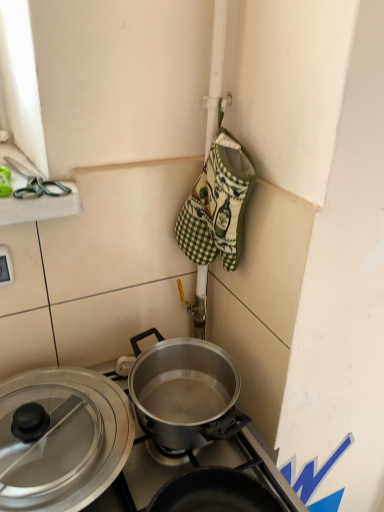
Question: Is green checkered oven mitt at center oriented away from white plastic electric outlet at lower left?

Choices:
 (A) yes
 (B) no

Answer: (B)

Question: Is green checkered oven mitt at center behind white plastic electric outlet at lower left?

Choices:
 (A) no
 (B) yes

Answer: (A)

Question: Can you confirm if green checkered oven mitt at center is bigger than white plastic electric outlet at lower left?

Choices:
 (A) no
 (B) yes

Answer: (B)

Question: Considering the relative sizes of green checkered oven mitt at center and white plastic electric outlet at lower left in the image provided, is green checkered oven mitt at center wider than white plastic electric outlet at lower left?

Choices:
 (A) yes
 (B) no

Answer: (A)

Question: Does green checkered oven mitt at center have a smaller size compared to white plastic electric outlet at lower left?

Choices:
 (A) no
 (B) yes

Answer: (A)

Question: Looking at the image, does polished silver pot at center seem bigger or smaller compared to white plastic electric outlet at lower left?

Choices:
 (A) small
 (B) big

Answer: (B)

Question: Based on their positions, is polished silver pot at center located to the left or right of white plastic electric outlet at lower left?

Choices:
 (A) left
 (B) right

Answer: (B)

Question: Is point (238, 442) positioned closer to the camera than point (1, 258)?

Choices:
 (A) farther
 (B) closer

Answer: (A)

Question: Is polished silver pot at center situated inside white plastic electric outlet at lower left or outside?

Choices:
 (A) inside
 (B) outside

Answer: (B)

Question: Looking at their shapes, would you say white plastic electric outlet at lower left is wider or thinner than green plastic scissors at upper left?

Choices:
 (A) thin
 (B) wide

Answer: (A)

Question: Is white plastic electric outlet at lower left in front of or behind green plastic scissors at upper left in the image?

Choices:
 (A) front
 (B) behind

Answer: (B)

Question: From the image's perspective, is white plastic electric outlet at lower left above or below green plastic scissors at upper left?

Choices:
 (A) above
 (B) below

Answer: (B)

Question: In the image, is white plastic electric outlet at lower left on the left side or the right side of green plastic scissors at upper left?

Choices:
 (A) right
 (B) left

Answer: (B)

Question: In the image, is white plastic electric outlet at lower left positioned in front of or behind polished silver pot at center?

Choices:
 (A) behind
 (B) front

Answer: (A)

Question: Does point (6, 284) appear closer or farther from the camera than point (211, 440)?

Choices:
 (A) farther
 (B) closer

Answer: (A)